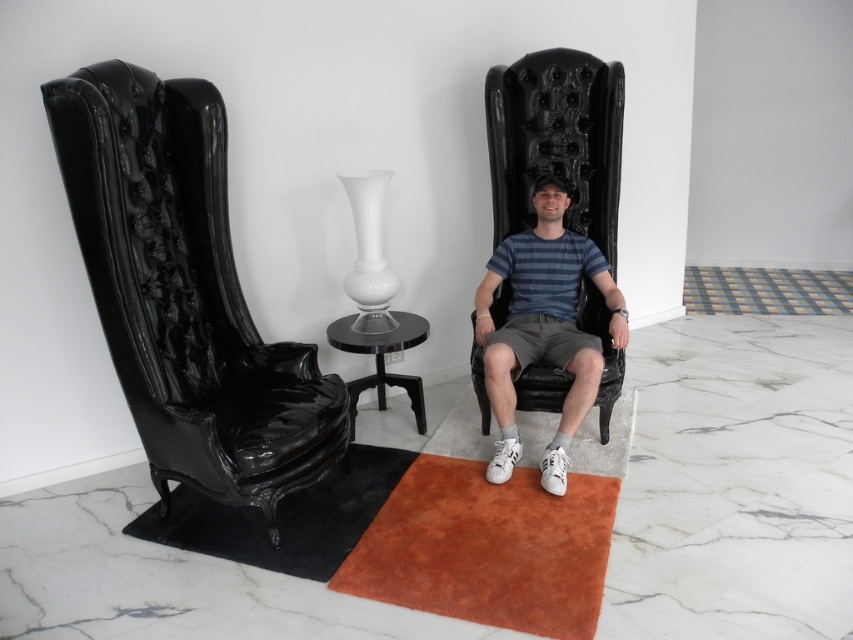
Between matte black chair at center and black rubber mat at lower left, which one is positioned higher?

Positioned higher is matte black chair at center.

Can you confirm if matte black chair at center is thinner than black rubber mat at lower left?

Yes.

Locate an element on the screen. This screenshot has height=640, width=853. matte black chair at center is located at coordinates (543, 326).

Where is `matte black chair at center`? matte black chair at center is located at coordinates (543, 326).

Between suede-like orange mat at lower center and matte black chair at center, which one is positioned higher?

Positioned higher is matte black chair at center.

Which is below, suede-like orange mat at lower center or matte black chair at center?

suede-like orange mat at lower center is below.

Which is in front, point (424, 547) or point (508, 358)?

Point (424, 547)

Find the location of `suede-like orange mat at lower center`. suede-like orange mat at lower center is located at coordinates (486, 548).

Does glossy black armchair at left come behind suede-like orange mat at lower center?

Yes, glossy black armchair at left is further from the viewer.

Is point (177, 432) farther from viewer compared to point (553, 545)?

No, it is not.

Does point (207, 420) come in front of point (428, 566)?

Yes.

Image resolution: width=853 pixels, height=640 pixels. What are the coordinates of `glossy black armchair at left` in the screenshot? It's located at (184, 292).